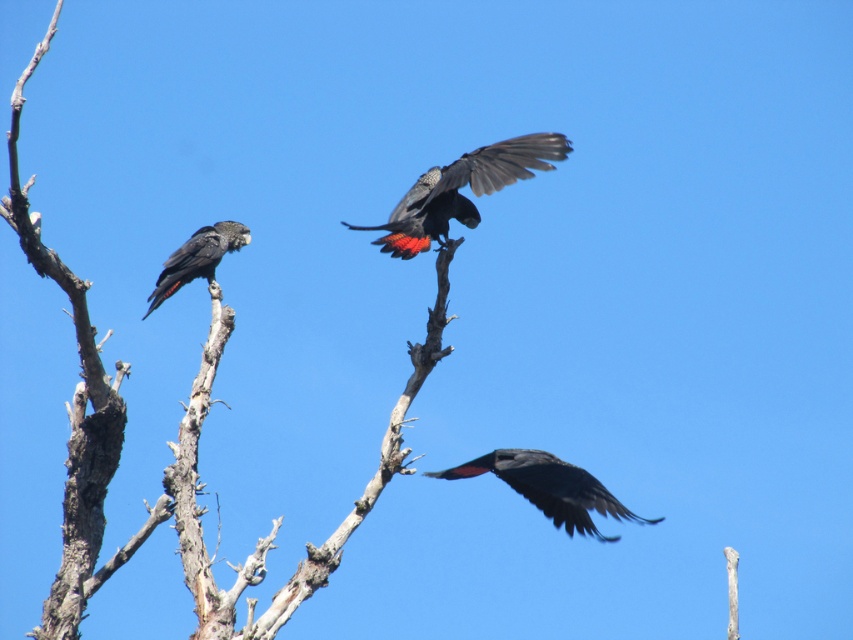
Can you confirm if shiny black bird at center is positioned below matte black parrot at left?

Actually, shiny black bird at center is above matte black parrot at left.

Can you confirm if shiny black bird at center is wider than matte black parrot at left?

Indeed, shiny black bird at center has a greater width compared to matte black parrot at left.

At what (x,y) coordinates should I click in order to perform the action: click on shiny black bird at center. Please return your answer as a coordinate pair (x, y). Looking at the image, I should click on (461, 195).

Is shiny black bird at center bigger than matte black bird at center?

Yes, shiny black bird at center is bigger than matte black bird at center.

Is shiny black bird at center in front of matte black bird at center?

Yes, it is in front of matte black bird at center.

Identify the location of shiny black bird at center. (461, 195).

The height and width of the screenshot is (640, 853). In order to click on shiny black bird at center in this screenshot , I will do `click(461, 195)`.

From the picture: Can you confirm if matte black bird at center is thinner than matte black parrot at left?

Indeed, matte black bird at center has a lesser width compared to matte black parrot at left.

Which is behind, point (566, 531) or point (228, 248)?

The point (228, 248) is more distant.

What are the coordinates of `matte black bird at center` in the screenshot? It's located at (549, 486).